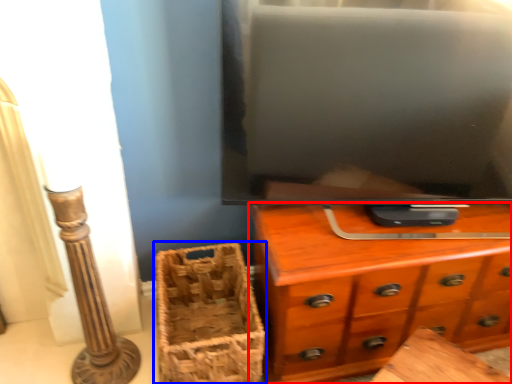
Question: Which object is further to the camera taking this photo, chest of drawers (highlighted by a red box) or basket (highlighted by a blue box)?

Choices:
 (A) chest of drawers
 (B) basket

Answer: (B)